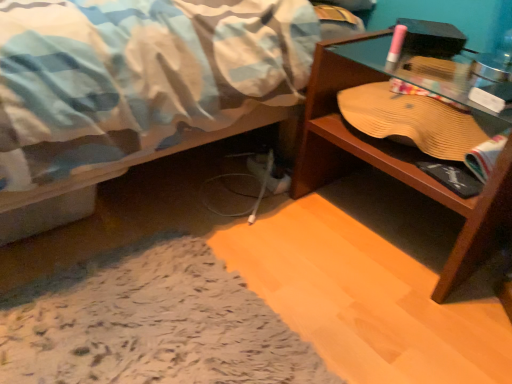
Identify the location of free point below wooden desk at right (from a real-world perspective). click(x=392, y=217).